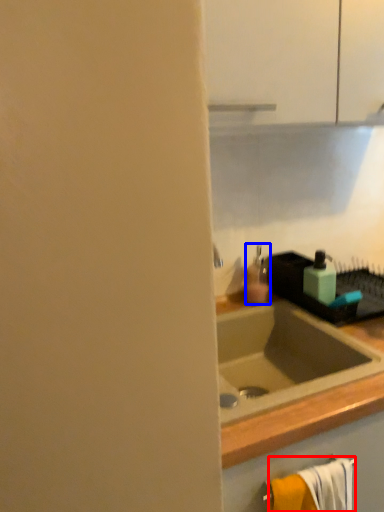
Question: Which object appears farthest to the camera in this image, bath towel (highlighted by a red box) or soap dispenser (highlighted by a blue box)?

Choices:
 (A) bath towel
 (B) soap dispenser

Answer: (B)